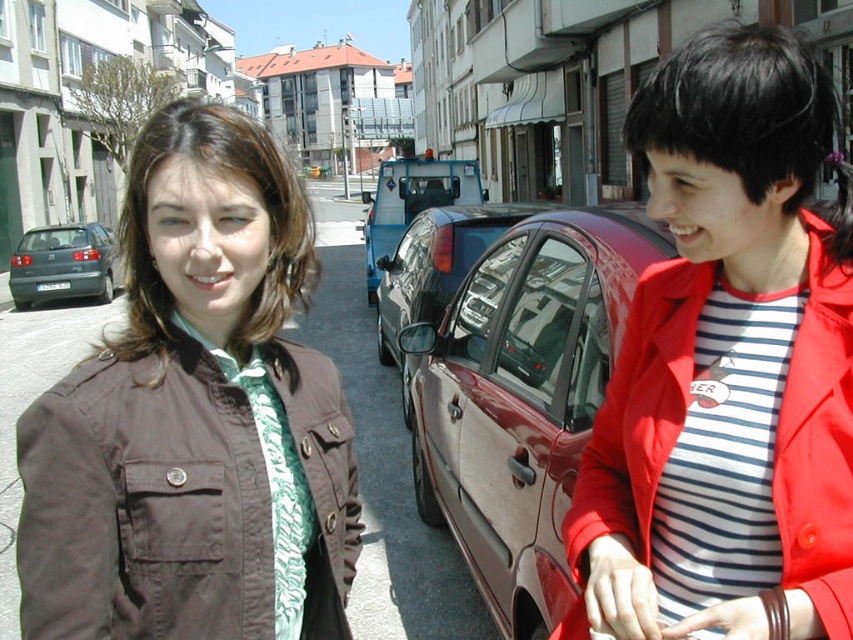
Image resolution: width=853 pixels, height=640 pixels. Describe the element at coordinates (819, 444) in the screenshot. I see `red matte coat at right` at that location.

Which is in front, point (817, 608) or point (82, 227)?

Positioned in front is point (817, 608).

Is point (798, 484) in front of point (18, 243)?

Yes, point (798, 484) is closer to viewer.

Where is `red matte coat at right`? This screenshot has height=640, width=853. red matte coat at right is located at coordinates (819, 444).

At what (x,y) coordinates should I click in order to perform the action: click on red matte coat at right. Please return your answer as a coordinate pair (x, y). The height and width of the screenshot is (640, 853). Looking at the image, I should click on (819, 444).

Measure the distance between red matte coat at right and camera.

red matte coat at right and camera are 3.51 feet apart from each other.

Find the location of a particular element. The width and height of the screenshot is (853, 640). red matte coat at right is located at coordinates (819, 444).

In the scene shown: Is brown fabric jacket at left taller than matte green car at left?

Incorrect, brown fabric jacket at left's height is not larger of matte green car at left's.

Can you confirm if brown fabric jacket at left is smaller than matte green car at left?

Correct, brown fabric jacket at left occupies less space than matte green car at left.

Is point (206, 563) closer to viewer compared to point (117, 273)?

Yes, it is.

Locate an element on the screen. This screenshot has width=853, height=640. brown fabric jacket at left is located at coordinates (195, 417).